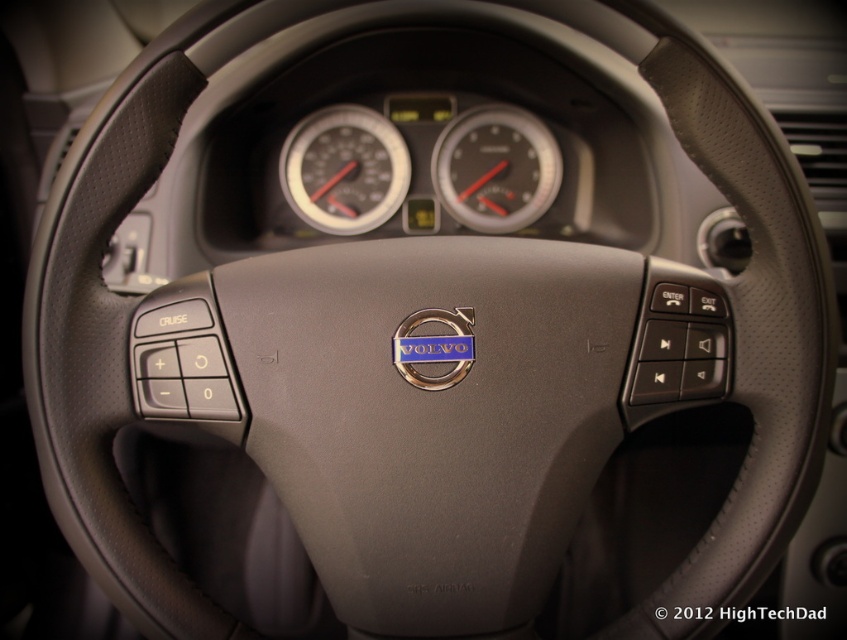
You are driving a Volvo and want to check your speed. You notice two speedometers at the center of the steering wheel. Which one is closer to you, the matte black speedometer at center or the black plastic speedometer at center?

The matte black speedometer at center is closer to you because the black plastic speedometer at center is behind it.

You are a car mechanic inspecting the dashboard of a Volvo. You notice two speedometers at the center. How far apart are the matte black speedometer at center and the black plastic speedometer at center?

The matte black speedometer at center is 16.06 centimeters from the black plastic speedometer at center.

You are sitting in the driver seat of the Volvo car. The speedometer is at point (344, 170). If you want to check your current speed, where should you look relative to the steering wheel?

The matte black speedometer at center is located at point (344, 170), which is at the center of the steering wheel. Therefore, you should look at the center of the steering wheel to check your current speed.